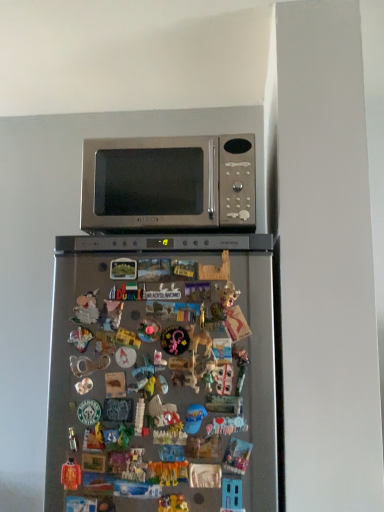
Question: From a real-world perspective, is plastic toy at center, the 1th toy in the right-to-left sequence, positioned over satin silver microwave at upper center based on gravity?

Choices:
 (A) no
 (B) yes

Answer: (A)

Question: From the image's perspective, is plastic toy at center, the 1th toy in the right-to-left sequence, on top of satin silver microwave at upper center?

Choices:
 (A) yes
 (B) no

Answer: (B)

Question: Considering the relative positions of plastic toy at center, arranged as the third toy when viewed from the left, and satin silver microwave at upper center in the image provided, is plastic toy at center, arranged as the third toy when viewed from the left, to the left of satin silver microwave at upper center from the viewer's perspective?

Choices:
 (A) yes
 (B) no

Answer: (B)

Question: Considering the relative sizes of plastic toy at center, the 1th toy in the right-to-left sequence, and satin silver microwave at upper center in the image provided, is plastic toy at center, the 1th toy in the right-to-left sequence, thinner than satin silver microwave at upper center?

Choices:
 (A) yes
 (B) no

Answer: (A)

Question: Does plastic toy at center, arranged as the third toy when viewed from the left, have a greater width compared to satin silver microwave at upper center?

Choices:
 (A) no
 (B) yes

Answer: (A)

Question: Is the depth of plastic toy at center, arranged as the third toy when viewed from the left, less than that of satin silver microwave at upper center?

Choices:
 (A) yes
 (B) no

Answer: (A)

Question: Can you confirm if plastic toy at center, the 1th toy in the right-to-left sequence, is smaller than matte orange toy at lower left, the third toy positioned from the right?

Choices:
 (A) no
 (B) yes

Answer: (B)

Question: Does plastic toy at center, the 1th toy in the right-to-left sequence, appear on the right side of matte orange toy at lower left, the third toy positioned from the right?

Choices:
 (A) yes
 (B) no

Answer: (A)

Question: Could you tell me if plastic toy at center, arranged as the third toy when viewed from the left, is facing matte orange toy at lower left, the 1th toy viewed from the left?

Choices:
 (A) no
 (B) yes

Answer: (A)

Question: Is the position of plastic toy at center, arranged as the third toy when viewed from the left, less distant than that of matte orange toy at lower left, the 1th toy viewed from the left?

Choices:
 (A) yes
 (B) no

Answer: (A)

Question: Considering the relative sizes of plastic toy at center, arranged as the third toy when viewed from the left, and matte orange toy at lower left, the 1th toy viewed from the left, in the image provided, is plastic toy at center, arranged as the third toy when viewed from the left, taller than matte orange toy at lower left, the 1th toy viewed from the left,?

Choices:
 (A) yes
 (B) no

Answer: (B)

Question: Are plastic toy at center, arranged as the third toy when viewed from the left, and matte orange toy at lower left, the third toy positioned from the right, located far from each other?

Choices:
 (A) no
 (B) yes

Answer: (A)

Question: Does satin silver refrigerator at center lie in front of multicolored plastic toy at center, which appears as the second toy when viewed from the right?

Choices:
 (A) no
 (B) yes

Answer: (B)